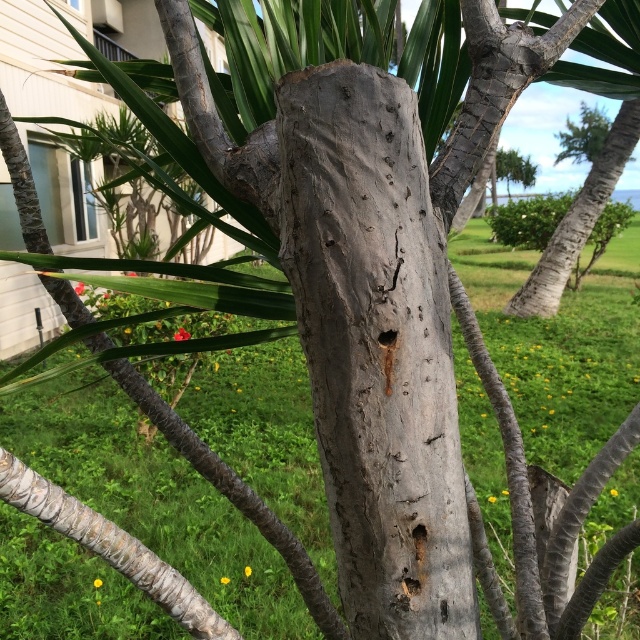
Question: Which point is farther to the camera?

Choices:
 (A) gray textured trunk at center
 (B) gray rough bark tree trunk at center

Answer: (A)

Question: Is gray rough bark tree trunk at center in front of gray textured trunk at center?

Choices:
 (A) no
 (B) yes

Answer: (B)

Question: Does gray rough bark tree trunk at center lie in front of gray textured trunk at center?

Choices:
 (A) no
 (B) yes

Answer: (B)

Question: From the image, what is the correct spatial relationship of gray rough bark tree trunk at center in relation to gray textured trunk at center?

Choices:
 (A) left
 (B) right

Answer: (A)